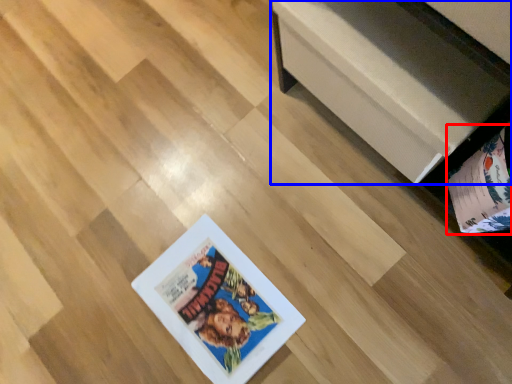
Question: Which point is closer to the camera, album (highlighted by a red box) or furniture (highlighted by a blue box)?

Choices:
 (A) album
 (B) furniture

Answer: (A)